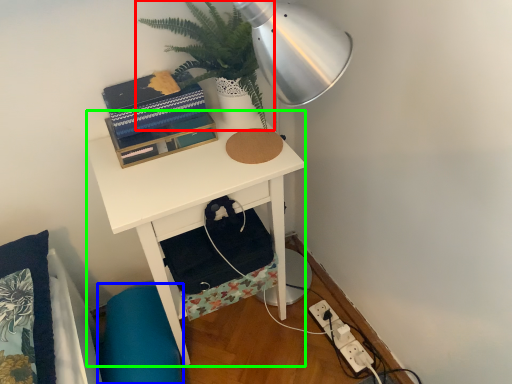
Question: Which object is positioned closest to houseplant (highlighted by a red box)? Select from swivel chair (highlighted by a blue box) and desk (highlighted by a green box).

Choices:
 (A) swivel chair
 (B) desk

Answer: (B)